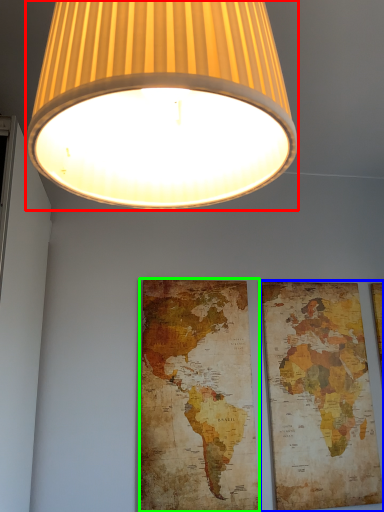
Question: Based on their relative distances, which object is nearer to lamp (highlighted by a red box)? Choose from picture frame (highlighted by a blue box) and map (highlighted by a green box).

Choices:
 (A) picture frame
 (B) map

Answer: (B)